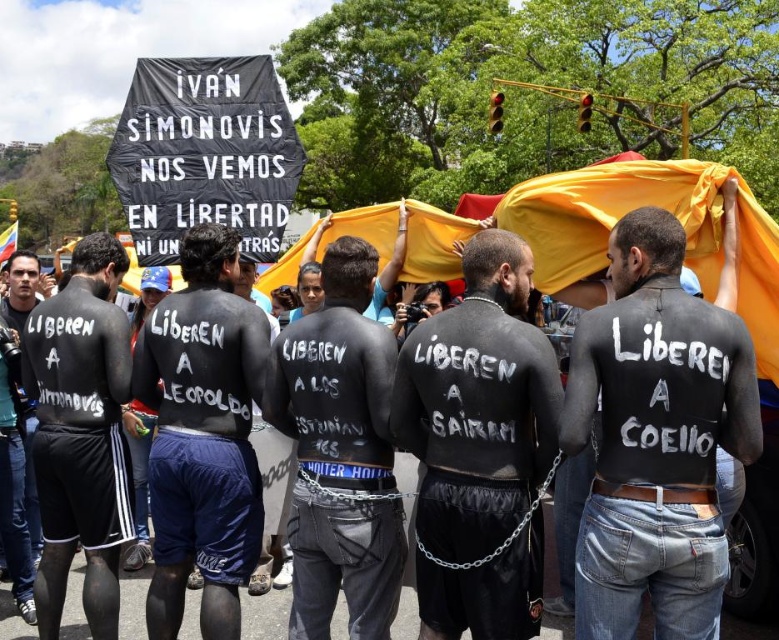
Who is shorter, black matte body at center or dark gray skin at left?

With less height is dark gray skin at left.

Which is behind, point (321, 273) or point (5, 566)?

Positioned behind is point (5, 566).

You are a GUI agent. You are given a task and a screenshot of the screen. Output one action in this format:
    pyautogui.click(x=<x>, y=<y>)
    Task: Click on the black matte body at center
    The width and height of the screenshot is (779, 640).
    Given the screenshot: What is the action you would take?
    pyautogui.click(x=339, y=451)

Between point (143, 378) and point (20, 268), which one is positioned in front?

Point (143, 378)

Consider the image. Can you confirm if black painted skin at center is positioned to the right of dark gray skin at left?

Yes, black painted skin at center is to the right of dark gray skin at left.

Is point (256, 554) positioned after point (30, 280)?

No, it is in front of (30, 280).

This screenshot has height=640, width=779. I want to click on black painted skin at center, so click(203, 435).

Can you confirm if black matte body at center is smaller than black matte shorts at lower left?

Yes, black matte body at center is smaller than black matte shorts at lower left.

Is black matte body at center taller than black matte shorts at lower left?

No, black matte body at center is not taller than black matte shorts at lower left.

What do you see at coordinates (339, 451) in the screenshot? I see `black matte body at center` at bounding box center [339, 451].

At what (x,y) coordinates should I click in order to perform the action: click on black matte body at center. Please return your answer as a coordinate pair (x, y). This screenshot has width=779, height=640. Looking at the image, I should click on (339, 451).